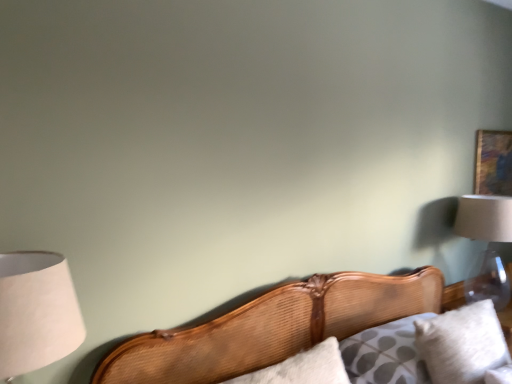
Question: Visually, is white paper lampshade at left, the 2th lamp from the back, positioned to the left or to the right of wooden cushion at lower right?

Choices:
 (A) left
 (B) right

Answer: (A)

Question: From the image's perspective, relative to wooden cushion at lower right, is white paper lampshade at left, the 2th lamp from the back, above or below?

Choices:
 (A) above
 (B) below

Answer: (A)

Question: Which is farther from the wooden bed at center?

Choices:
 (A) wooden picture frame at upper right
 (B) white soft pillow at lower right
 (C) white paper lampshade at left, arranged as the second lamp when viewed from the right
 (D) clear glass lampshade at upper right, the second lamp positioned from the left
 (E) wooden cushion at lower right

Answer: (A)

Question: Which object is the closest to the wooden picture frame at upper right?

Choices:
 (A) white paper lampshade at left, which appears as the 1th lamp when viewed from the front
 (B) white soft pillow at lower right
 (C) wooden bed at center
 (D) clear glass lampshade at upper right, which appears as the 1th lamp when viewed from the back
 (E) wooden cushion at lower right

Answer: (D)